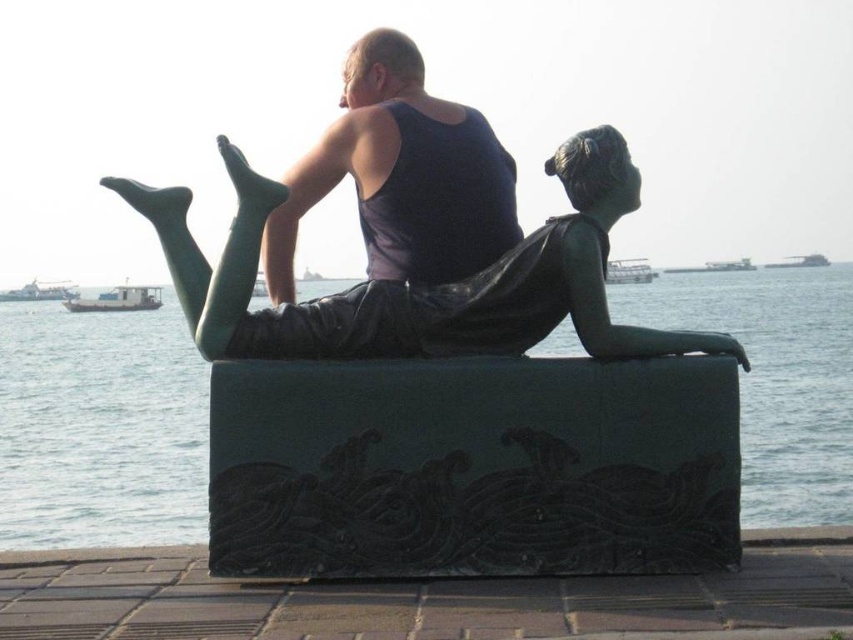
Can you confirm if white glossy boat at left is positioned above metallic gray ship at upper center?

Actually, white glossy boat at left is below metallic gray ship at upper center.

I want to click on white glossy boat at left, so click(39, 291).

What do you see at coordinates (39, 291) in the screenshot? This screenshot has height=640, width=853. I see `white glossy boat at left` at bounding box center [39, 291].

Where is `white glossy boat at left`? This screenshot has width=853, height=640. white glossy boat at left is located at coordinates (39, 291).

Between point (563, 630) and point (148, 300), which one is positioned in front?

Point (563, 630)

Is black stone dock at lower center smaller than green matte boat at left?

Yes, black stone dock at lower center is smaller than green matte boat at left.

Who is more distant from viewer, (x=505, y=586) or (x=120, y=289)?

Positioned behind is point (x=120, y=289).

At what (x,y) coordinates should I click in order to perform the action: click on black stone dock at lower center. Please return your answer as a coordinate pair (x, y). Looking at the image, I should click on (428, 600).

Who is shorter, black stone dock at lower center or matte black tank top at center?

Standing shorter between the two is black stone dock at lower center.

Is the position of black stone dock at lower center less distant than that of matte black tank top at center?

Yes, it is in front of matte black tank top at center.

The height and width of the screenshot is (640, 853). What do you see at coordinates (428, 600) in the screenshot? I see `black stone dock at lower center` at bounding box center [428, 600].

This screenshot has height=640, width=853. In order to click on black stone dock at lower center in this screenshot , I will do `click(428, 600)`.